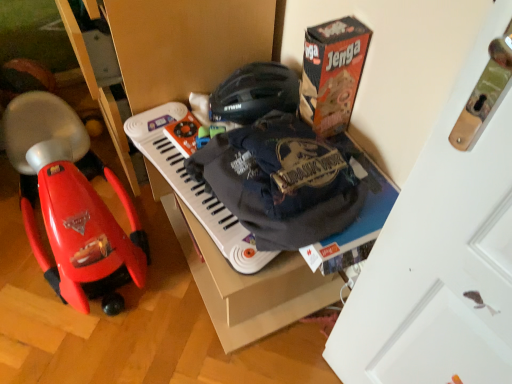
Question: Would you say white matte door at upper right is inside or outside white plastic musical keyboard at center?

Choices:
 (A) inside
 (B) outside

Answer: (B)

Question: Is white matte door at upper right wider or thinner than white plastic musical keyboard at center?

Choices:
 (A) wide
 (B) thin

Answer: (B)

Question: Which is nearer to the shiny red plastic baby carriage at left?

Choices:
 (A) white plastic musical keyboard at center
 (B) white matte door at upper right
 (C) orange cardboard jenga box at upper right

Answer: (A)

Question: Based on their relative distances, which object is nearer to the white plastic musical keyboard at center?

Choices:
 (A) orange cardboard jenga box at upper right
 (B) white matte door at upper right
 (C) shiny red plastic baby carriage at left

Answer: (A)